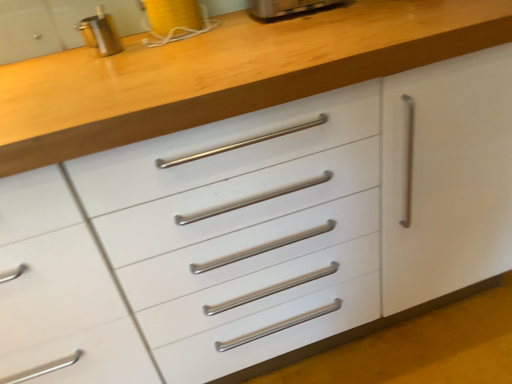
The image size is (512, 384). Find the location of `free space in front of metallic silver canister at upper left`. free space in front of metallic silver canister at upper left is located at coordinates (92, 69).